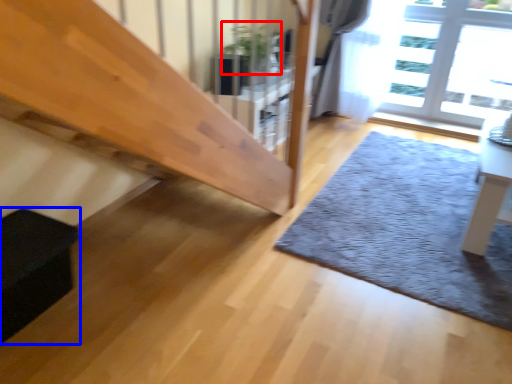
Question: Which of the following is the farthest to the observer, plant (highlighted by a red box) or furniture (highlighted by a blue box)?

Choices:
 (A) plant
 (B) furniture

Answer: (A)